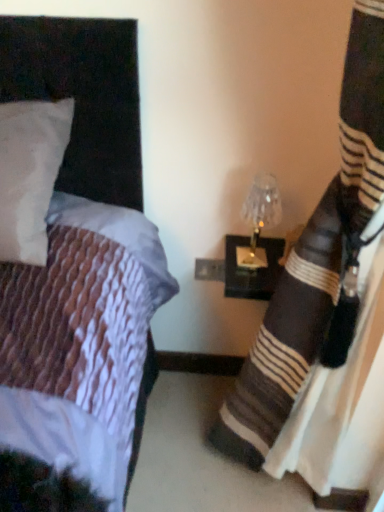
Question: Considering the relative sizes of translucent glass lampshade at right and black striped fabric at right in the image provided, is translucent glass lampshade at right thinner than black striped fabric at right?

Choices:
 (A) yes
 (B) no

Answer: (A)

Question: Is the position of translucent glass lampshade at right less distant than that of black striped fabric at right?

Choices:
 (A) yes
 (B) no

Answer: (B)

Question: Is translucent glass lampshade at right at the right side of black striped fabric at right?

Choices:
 (A) no
 (B) yes

Answer: (A)

Question: Is translucent glass lampshade at right further to the viewer compared to black striped fabric at right?

Choices:
 (A) no
 (B) yes

Answer: (B)

Question: Is translucent glass lampshade at right aimed at black striped fabric at right?

Choices:
 (A) yes
 (B) no

Answer: (A)

Question: From a real-world perspective, is translucent glass lampshade at right located beneath black striped fabric at right?

Choices:
 (A) yes
 (B) no

Answer: (B)

Question: Does black striped fabric at right have a greater width compared to translucent glass lampshade at right?

Choices:
 (A) no
 (B) yes

Answer: (B)

Question: Can you confirm if black striped fabric at right is positioned to the right of translucent glass lampshade at right?

Choices:
 (A) no
 (B) yes

Answer: (B)

Question: Is black striped fabric at right facing towards translucent glass lampshade at right?

Choices:
 (A) yes
 (B) no

Answer: (B)

Question: From the image's perspective, would you say black striped fabric at right is positioned over translucent glass lampshade at right?

Choices:
 (A) yes
 (B) no

Answer: (B)

Question: Does black striped fabric at right have a lesser width compared to translucent glass lampshade at right?

Choices:
 (A) yes
 (B) no

Answer: (B)

Question: Is black striped fabric at right positioned with its back to translucent glass lampshade at right?

Choices:
 (A) yes
 (B) no

Answer: (B)

Question: In terms of height, does black striped fabric at right look taller or shorter compared to translucent glass lampshade at right?

Choices:
 (A) short
 (B) tall

Answer: (B)